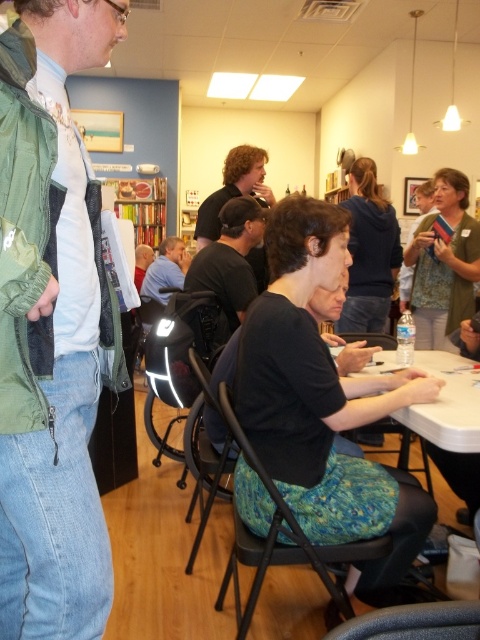
In the scene shown: A person is standing at point (421, 348) and wants to walk to the tables in the center. The person is 1.7 meters tall. Can they comfortably walk from their position to the tables without any obstacles?

The distance between the person at point (421, 348) and the tables in the center is 3.28 meters. Since the person is 1.7 meters tall, they can comfortably walk to the tables as there are no obstacles mentioned in the scene description.

You are a person who wants to sit down at the black plastic chair at center. The dark blue sweater at center is currently on the seat. Can you sit there without moving the sweater?

The distance between the black plastic chair at center and the dark blue sweater at center is 1.24 meters. Since the sweater is on the seat of the chair, you would need to move it to sit down.

You are organizing a small event and need to place a large poster on the wall behind the black plastic chair at center and dark blue sweater at center. Which object should you position the poster closer to if you want it to be more visible to people sitting at the larger object?

The black plastic chair at center is bigger than the dark blue sweater at center, so positioning the poster closer to the black plastic chair at center would make it more visible to those sitting there.